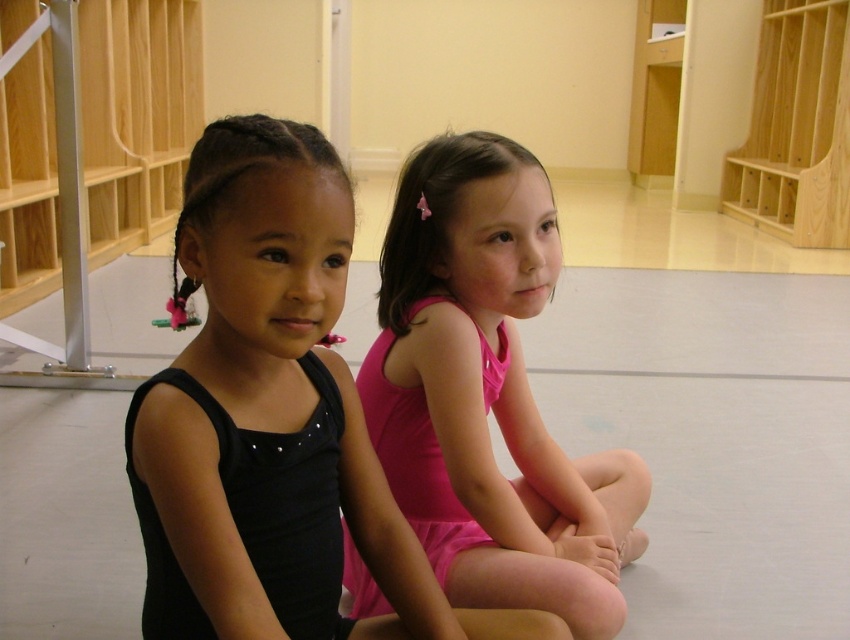
Question: Which point is farther to the camera?

Choices:
 (A) (275, 413)
 (B) (551, 448)

Answer: (B)

Question: Which point is farther to the camera?

Choices:
 (A) (517, 451)
 (B) (190, 177)

Answer: (A)

Question: Observing the image, what is the correct spatial positioning of black matte leotard at left in reference to pink satin leotard at center?

Choices:
 (A) left
 (B) right

Answer: (A)

Question: Does black matte leotard at left lie behind pink satin leotard at center?

Choices:
 (A) yes
 (B) no

Answer: (B)

Question: Is black matte leotard at left closer to the viewer compared to pink satin leotard at center?

Choices:
 (A) no
 (B) yes

Answer: (B)